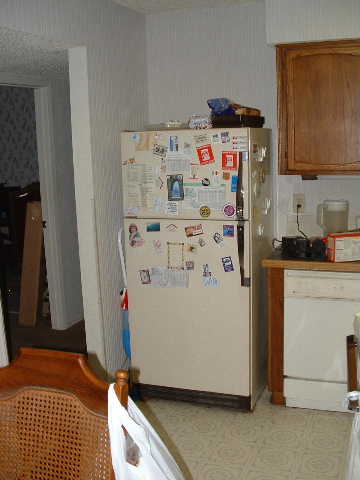
Locate an element on the screen. Image resolution: width=360 pixels, height=480 pixels. cardboard box/ packaging is located at coordinates (36, 249).